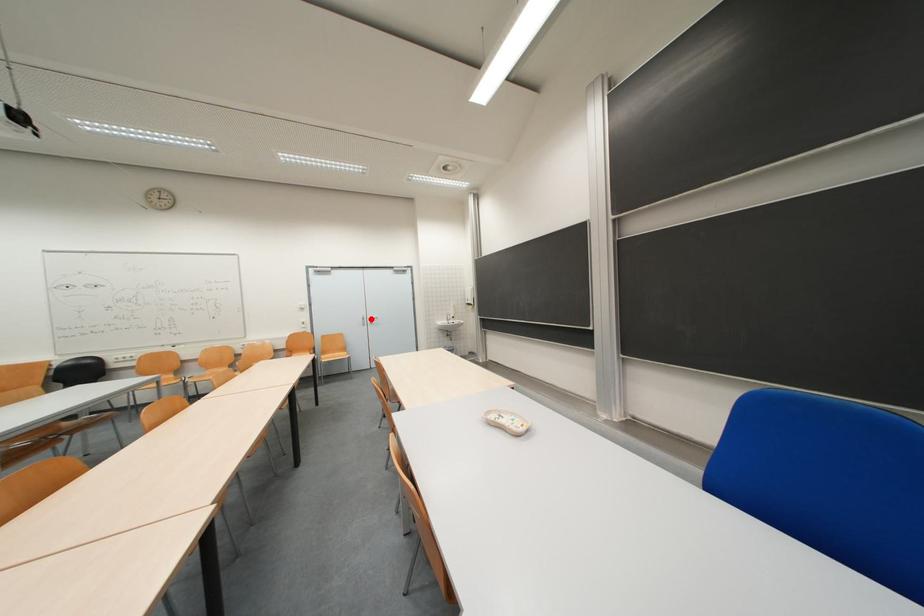
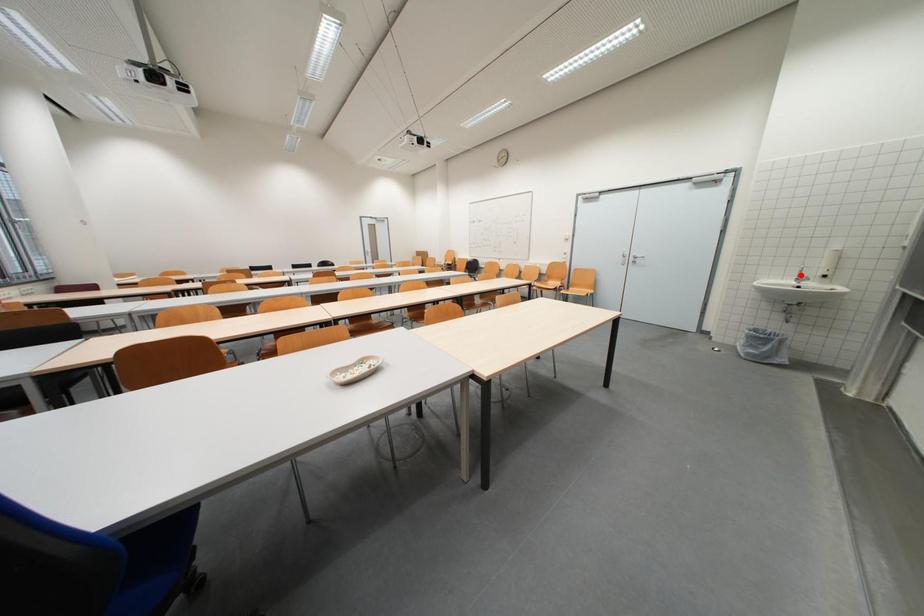
I am providing you with two images of the same scene from different viewpoints. A red point is marked on the first image and another point is marked on the second image. Is the red point in image1 aligned with the point shown in image2?

No